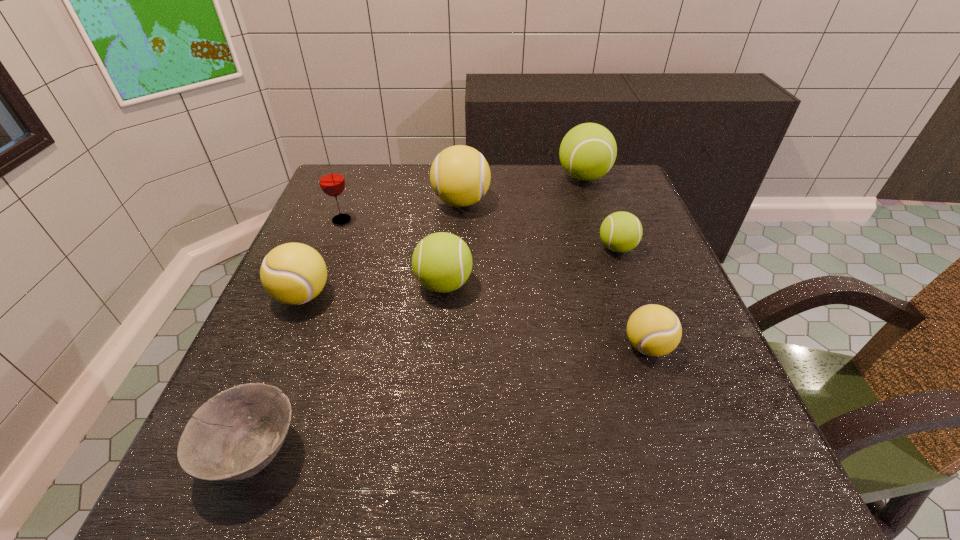
The image size is (960, 540). In order to click on yellow tennis ball that stands as the second closest to the rightmost yellow tennis ball in this screenshot , I will do `click(293, 273)`.

Locate which yellow tennis ball ranks second in proximity to the leftmost yellow tennis ball. Please provide its 2D coordinates. Your answer should be formatted as a tuple, i.e. [(x, y)], where the tuple contains the x and y coordinates of a point satisfying the conditions above.

[(654, 330)]

Where is `vacant region that satisfies the following two spatial constraints: 1. on the back side of the smallest green tennis ball; 2. on the right side of the leftmost green tennis ball`? vacant region that satisfies the following two spatial constraints: 1. on the back side of the smallest green tennis ball; 2. on the right side of the leftmost green tennis ball is located at coordinates (447, 248).

At what (x,y) coordinates should I click in order to perform the action: click on vacant space that satisfies the following two spatial constraints: 1. on the back side of the second nearest yellow tennis ball; 2. on the right side of the farthest green tennis ball. Please return your answer as a coordinate pair (x, y). The image size is (960, 540). Looking at the image, I should click on pos(351,177).

I want to click on free space that satisfies the following two spatial constraints: 1. on the front side of the second nearest object; 2. on the left side of the leftmost yellow tennis ball, so click(x=281, y=347).